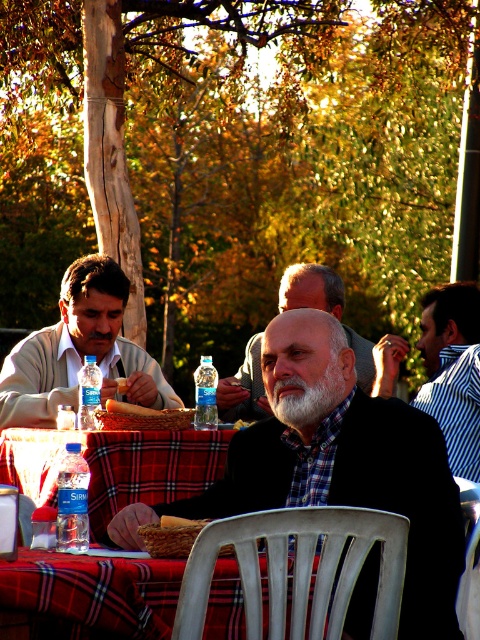
You are a photographer adjusting your camera to focus on the matte gray sweater at left and the sliced bread at table center. Which object should you adjust the focus to first if you want to capture both in the same frame without moving the camera?

The matte gray sweater at left is taller than the sliced bread at table center, so you should focus on the matte gray sweater at left first to ensure its height is properly captured in the frame.

You are a photographer adjusting your camera settings to focus on two specific points in the scene. The first point is at coordinates point (x=61, y=392) and the second is at point (x=422, y=352). Which point should you focus on first if you want to ensure the closest object is in sharp focus?

You should focus on point (x=61, y=392) first because it is closer to the camera than point (x=422, y=352), ensuring the closest object is in sharp focus.

You are a photographer taking a picture of the group seated at the table. You notice the gray wool sweater at center and the whitehairbeard at center. Which object should you focus on first if you want to capture both in the same frame without moving the camera?

The gray wool sweater at center is above the whitehairbeard at center, so you should focus on the gray wool sweater at center first as it is closer to the camera.